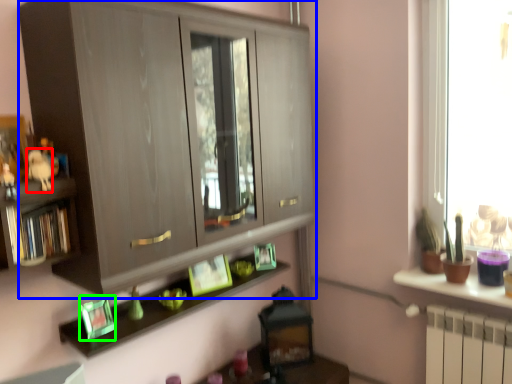
Question: Which is nearer to the animal (highlighted by a red box)? cabinetry (highlighted by a blue box) or picture frame (highlighted by a green box).

Choices:
 (A) cabinetry
 (B) picture frame

Answer: (B)